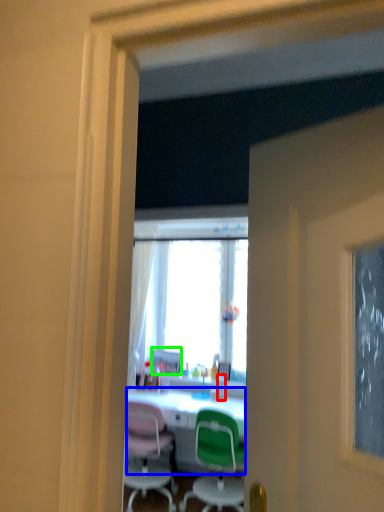
Question: Which object is the closest to the bottle (highlighted by a red box)? Choose among these: desk (highlighted by a blue box) or picture frame (highlighted by a green box).

Choices:
 (A) desk
 (B) picture frame

Answer: (A)